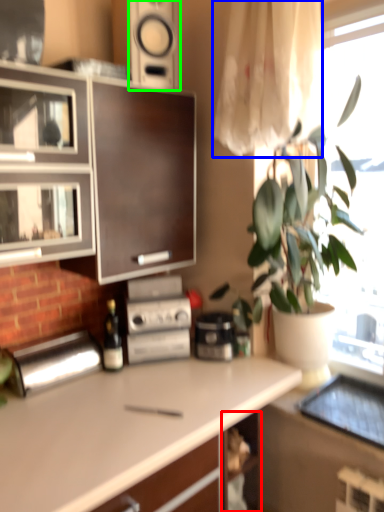
Question: Which object is the closest to the shelf (highlighted by a red box)? Choose among these: curtain (highlighted by a blue box) or speaker (highlighted by a green box).

Choices:
 (A) curtain
 (B) speaker

Answer: (A)